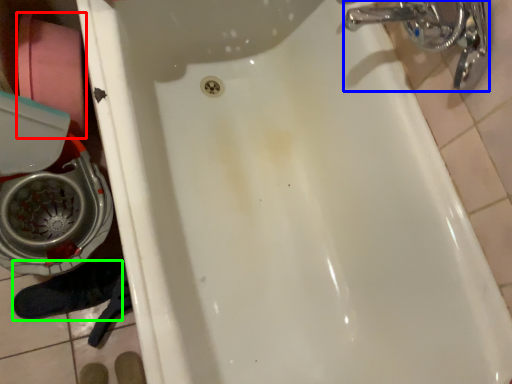
Question: Which object is the farthest from toilet paper (highlighted by a red box)? Choose among these: plumbing fixture (highlighted by a blue box) or shoe (highlighted by a green box).

Choices:
 (A) plumbing fixture
 (B) shoe

Answer: (A)